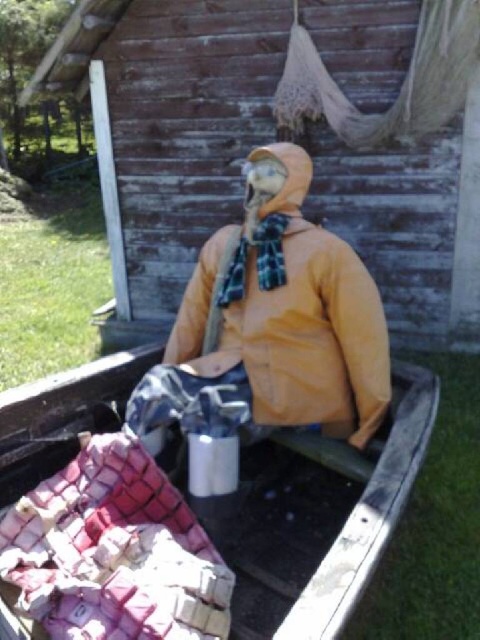
You are standing in the rustic outdoor scene and want to place a small potted plant between the wooden boat at center and the yellow matte jacket at center. Based on their positions, where should you place the plant?

The wooden boat at center is located below the yellow matte jacket at center, so you should place the small potted plant between them vertically, positioning it either above the wooden boat at center or below the yellow matte jacket at center to maintain spatial separation.

You are a delivery robot with a width of 50 centimeters. You need to move from the wooden boat at center to the yellow matte jacket at center. Can you pass through the space between them without any obstacles?

The distance between wooden boat at center and yellow matte jacket at center is 58.50 centimeters. Since the robot is 50 centimeters wide, there is enough space for it to pass through the gap between them without any issues.

You are a painter standing in front of the wooden hut at center and the yellow matte jacket at center. You want to paint both subjects but can only focus on the one that is taller. Which one should you choose?

The wooden hut at center is taller than the yellow matte jacket at center, so you should choose to paint the wooden hut at center first.